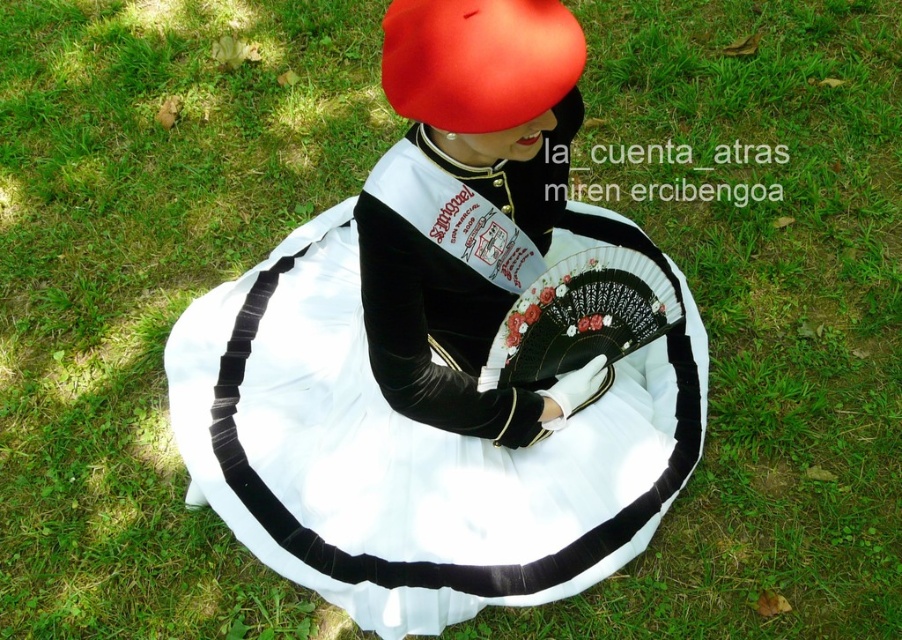
Can you confirm if white satin dress at center is positioned to the left of matte red hat at upper center?

Indeed, white satin dress at center is positioned on the left side of matte red hat at upper center.

What do you see at coordinates (410, 452) in the screenshot? This screenshot has width=902, height=640. I see `white satin dress at center` at bounding box center [410, 452].

Between point (259, 266) and point (488, 81), which one is positioned in front?

Positioned in front is point (488, 81).

The image size is (902, 640). Identify the location of white satin dress at center. (410, 452).